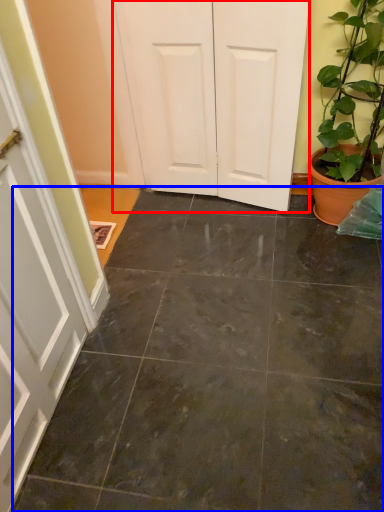
Question: Among these objects, which one is farthest to the camera, door (highlighted by a red box) or concrete (highlighted by a blue box)?

Choices:
 (A) door
 (B) concrete

Answer: (A)